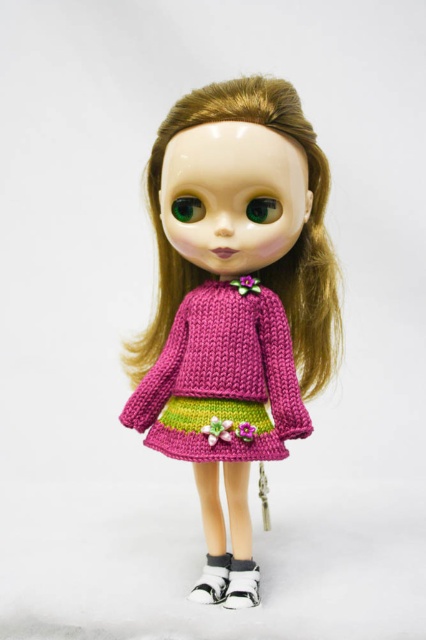
Is knitted pink sweater at center positioned before white fabric shoe at lower center?

That is True.

Can you confirm if knitted pink sweater at center is positioned below white fabric shoe at lower center?

Actually, knitted pink sweater at center is above white fabric shoe at lower center.

Between point (252, 337) and point (232, 556), which one is positioned behind?

Point (232, 556)

Where is `knitted pink sweater at center`? knitted pink sweater at center is located at coordinates (235, 291).

Is knitted pink dress at center closer to camera compared to white knitted socks at lower center?

Yes, knitted pink dress at center is closer to the viewer.

Image resolution: width=426 pixels, height=640 pixels. What do you see at coordinates (221, 380) in the screenshot?
I see `knitted pink dress at center` at bounding box center [221, 380].

Locate an element on the screen. Image resolution: width=426 pixels, height=640 pixels. knitted pink dress at center is located at coordinates (221, 380).

Between point (253, 392) and point (232, 580), which one is positioned in front?

Point (253, 392)

From the picture: Is knitted pink dress at center to the right of white fabric shoe at lower center from the viewer's perspective?

Incorrect, knitted pink dress at center is not on the right side of white fabric shoe at lower center.

At what (x,y) coordinates should I click in order to perform the action: click on knitted pink dress at center. Please return your answer as a coordinate pair (x, y). The height and width of the screenshot is (640, 426). Looking at the image, I should click on (221, 380).